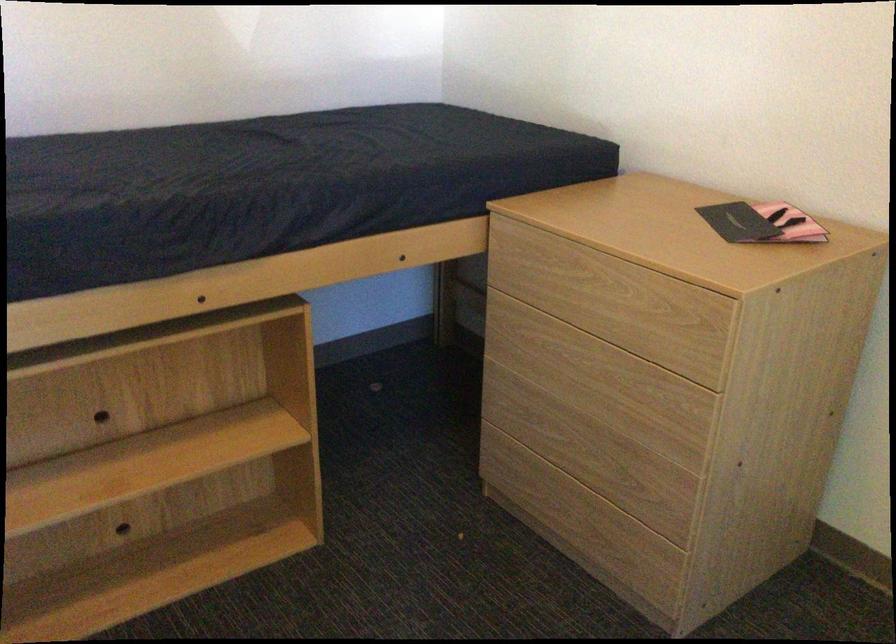
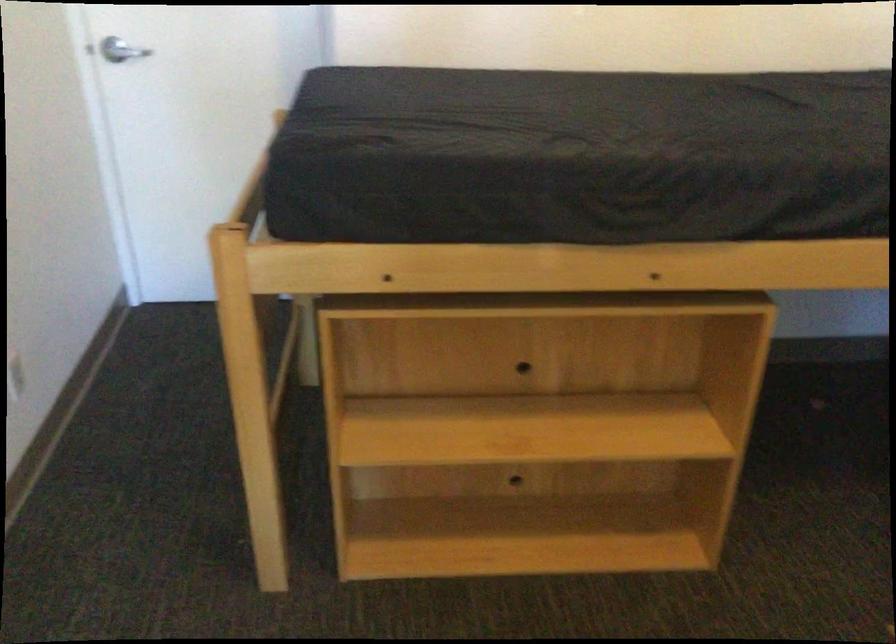
Which direction would the cameraman need to move to produce the second image?

The cameraman walked toward left, forward.